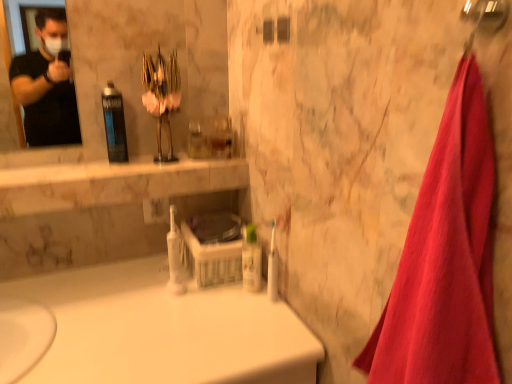
Question: Considering the relative positions of white plastic toothbrush at center and translucent plastic mouthwash at center, the first mouthwash when ordered from top to bottom, in the image provided, is white plastic toothbrush at center to the left or to the right of translucent plastic mouthwash at center, the first mouthwash when ordered from top to bottom,?

Choices:
 (A) right
 (B) left

Answer: (A)

Question: Is point (273, 238) closer or farther from the camera than point (116, 109)?

Choices:
 (A) farther
 (B) closer

Answer: (B)

Question: Considering the real-world distances, which object is farthest from the white plastic toothbrush at center, positioned as the 2th mouthwash in right-to-left order?

Choices:
 (A) red cotton towel at right
 (B) translucent plastic mouthwash at center, which is the third mouthwash in bottom-to-top order
 (C) white plastic toothbrush at center
 (D) clear plastic bottle at center, which is the third mouthwash from top to bottom
 (E) white glossy bathtub at center

Answer: (A)

Question: Considering the real-world distances, which object is closest to the white glossy bathtub at center?

Choices:
 (A) red cotton towel at right
 (B) translucent plastic mouthwash at center, which is the third mouthwash in bottom-to-top order
 (C) white plastic toothbrush at center
 (D) white plastic toothbrush at center, the second mouthwash positioned from the left
 (E) clear plastic bottle at center, which is the third mouthwash from top to bottom

Answer: (D)